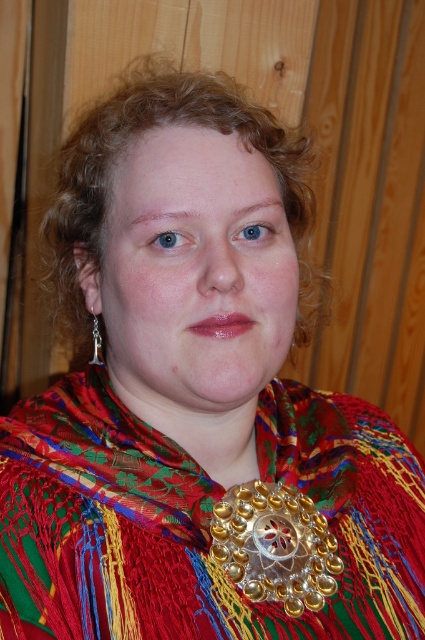
Question: Does multicolored woven scarf at center have a larger size compared to curly blonde hair at center?

Choices:
 (A) no
 (B) yes

Answer: (A)

Question: Which point is farther from the camera taking this photo?

Choices:
 (A) (70, 333)
 (B) (2, 525)
 (C) (280, 586)

Answer: (A)

Question: Is curly blonde hair at center to the right of gold metallic necklace at center from the viewer's perspective?

Choices:
 (A) no
 (B) yes

Answer: (A)

Question: Does multicolored woven scarf at center have a larger size compared to curly blonde hair at center?

Choices:
 (A) no
 (B) yes

Answer: (A)

Question: Considering the real-world distances, which object is closest to the multicolored woven scarf at center?

Choices:
 (A) curly blonde hair at center
 (B) gold metallic necklace at center

Answer: (B)

Question: Which of the following is the farthest from the observer?

Choices:
 (A) multicolored woven scarf at center
 (B) gold metallic necklace at center

Answer: (B)